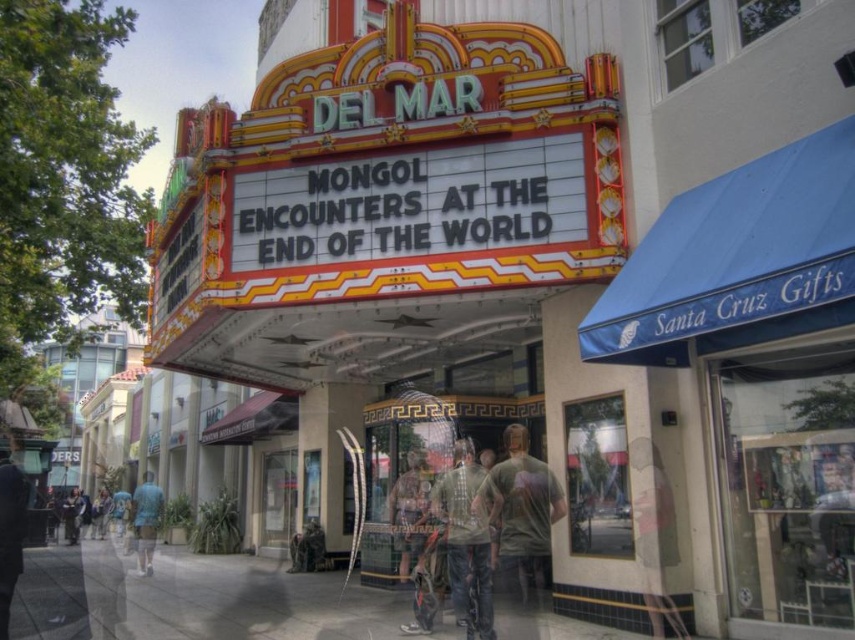
Question: Can you confirm if smooth concrete sidewalk at center is positioned above dark gray jacket at lower left?

Choices:
 (A) yes
 (B) no

Answer: (B)

Question: Which is farther from the dark gray jacket at lower left?

Choices:
 (A) camouflage fabric shirt at center
 (B) smooth concrete sidewalk at center
 (C) green cotton t-shirt at center

Answer: (C)

Question: Does smooth concrete sidewalk at center appear on the left side of green cotton t-shirt at center?

Choices:
 (A) no
 (B) yes

Answer: (B)

Question: Where is green cotton t-shirt at center located in relation to camouflage jacket at center in the image?

Choices:
 (A) above
 (B) below

Answer: (A)

Question: Which point is closer to the camera?

Choices:
 (A) dark gray jacket at lower left
 (B) smooth concrete sidewalk at center

Answer: (B)

Question: Which point is farther to the camera?

Choices:
 (A) (63, 522)
 (B) (68, 556)

Answer: (A)